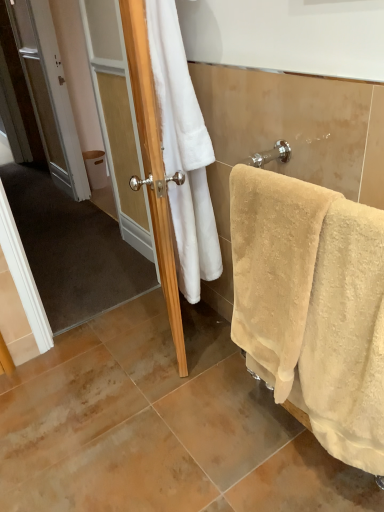
Describe the element at coordinates (183, 152) in the screenshot. I see `white fluffy towel at left` at that location.

Identify the location of white fluffy towel at left. (183, 152).

At what (x,y) coordinates should I click in order to perform the action: click on white fluffy towel at left. Please return your answer as a coordinate pair (x, y). The width and height of the screenshot is (384, 512). Looking at the image, I should click on (183, 152).